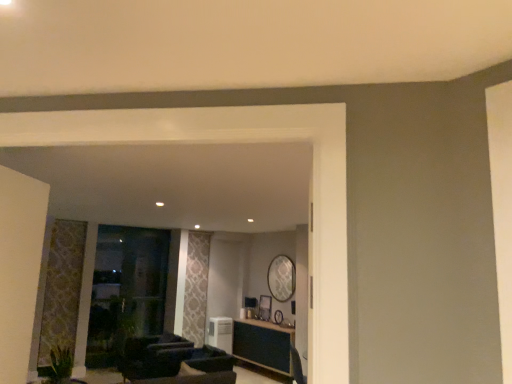
Question: Considering the relative sizes of wooden picture frame at center and green leafy plant at lower left in the image provided, is wooden picture frame at center smaller than green leafy plant at lower left?

Choices:
 (A) yes
 (B) no

Answer: (A)

Question: From a real-world perspective, is wooden picture frame at center over green leafy plant at lower left?

Choices:
 (A) yes
 (B) no

Answer: (A)

Question: Does wooden picture frame at center come in front of green leafy plant at lower left?

Choices:
 (A) no
 (B) yes

Answer: (A)

Question: Are wooden picture frame at center and green leafy plant at lower left located far from each other?

Choices:
 (A) yes
 (B) no

Answer: (A)

Question: Can you confirm if wooden picture frame at center is positioned to the left of green leafy plant at lower left?

Choices:
 (A) yes
 (B) no

Answer: (B)

Question: In the image, is wooden table at center positioned in front of or behind green leafy plant at lower left?

Choices:
 (A) front
 (B) behind

Answer: (B)

Question: From a real-world perspective, is wooden table at center positioned above or below green leafy plant at lower left?

Choices:
 (A) below
 (B) above

Answer: (A)

Question: Is wooden table at center taller or shorter than green leafy plant at lower left?

Choices:
 (A) short
 (B) tall

Answer: (B)

Question: Is point (233, 347) positioned closer to the camera than point (53, 377)?

Choices:
 (A) closer
 (B) farther

Answer: (B)

Question: Considering the positions of white plastic air conditioner at center and green leafy plant at lower left in the image, is white plastic air conditioner at center wider or thinner than green leafy plant at lower left?

Choices:
 (A) thin
 (B) wide

Answer: (A)

Question: Considering the positions of white plastic air conditioner at center and green leafy plant at lower left in the image, is white plastic air conditioner at center taller or shorter than green leafy plant at lower left?

Choices:
 (A) tall
 (B) short

Answer: (A)

Question: From a real-world perspective, is white plastic air conditioner at center positioned above or below green leafy plant at lower left?

Choices:
 (A) below
 (B) above

Answer: (A)

Question: Looking at the image, does white plastic air conditioner at center seem bigger or smaller compared to green leafy plant at lower left?

Choices:
 (A) small
 (B) big

Answer: (B)

Question: Visually, is dark brown leather armchair at center positioned to the left or to the right of wooden picture frame at center?

Choices:
 (A) right
 (B) left

Answer: (B)

Question: From the image's perspective, relative to wooden picture frame at center, is dark brown leather armchair at center above or below?

Choices:
 (A) above
 (B) below

Answer: (A)